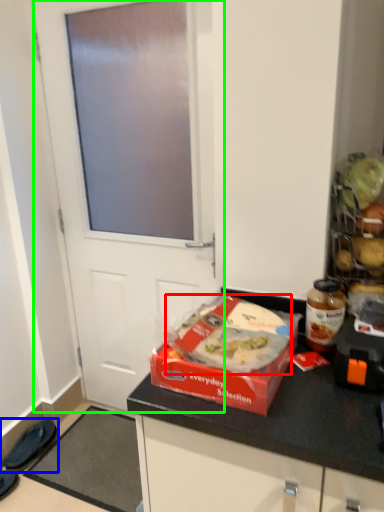
Question: Which is nearer to the food (highlighted by a red box)? footwear (highlighted by a blue box) or door (highlighted by a green box).

Choices:
 (A) footwear
 (B) door

Answer: (B)